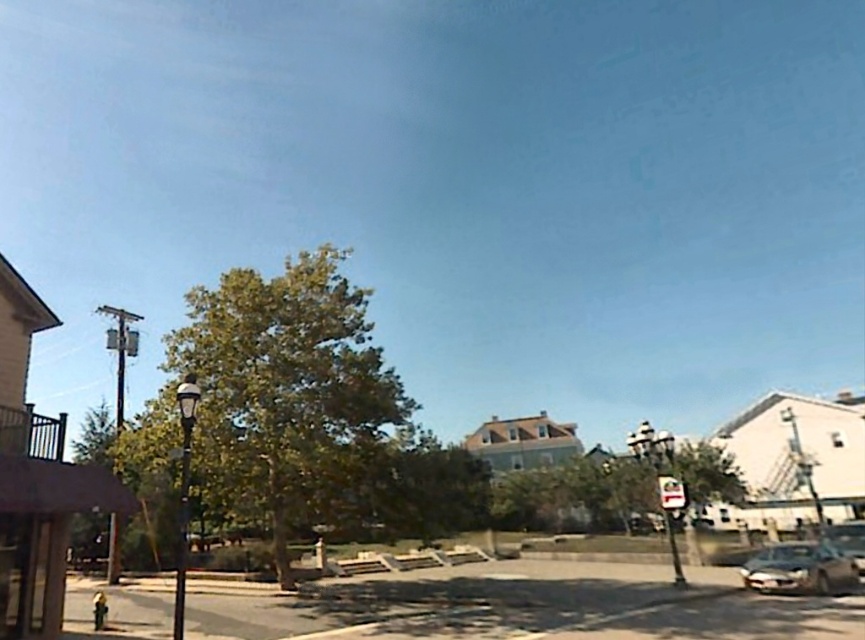
You are standing at the point closer to the camera in the image. Which of the two points, point (774,582) or point (671,504), are you standing at?

You are standing at point (774,582) because it is closer to the camera than point (671,504).

You are a delivery driver who needs to park your shiny silver car at lower right near the white plastic street sign at center. Given that the parking space next to the sign can only accommodate vehicles up to the size of the sign, will your car fit?

The shiny silver car at lower right is larger in size than the white plastic street sign at center. Therefore, the car will not fit in the parking space designated for vehicles up to the size of the sign.

You are standing at the point labeled as point (798, 568). Looking around, you see a shiny silver car at lower right. What is the nearest object to you in this scene?

The nearest object to you is the shiny silver car at lower right because it is located at the lower right position closest to your current position at point (798, 568).